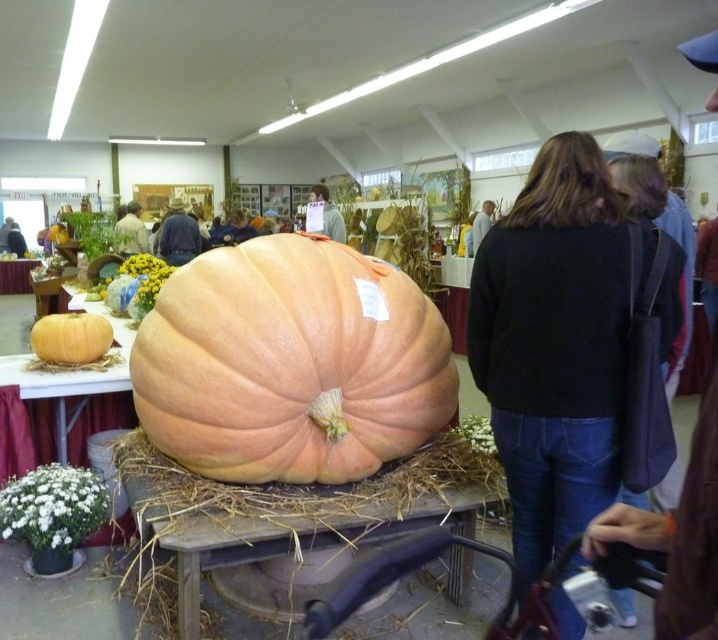
Measure the distance between dark blue fabric at center and camera.

dark blue fabric at center and camera are 6.92 meters apart from each other.

This screenshot has width=718, height=640. What do you see at coordinates (177, 236) in the screenshot? I see `dark blue fabric at center` at bounding box center [177, 236].

At what (x,y) coordinates should I click in order to perform the action: click on dark blue fabric at center. Please return your answer as a coordinate pair (x, y). Looking at the image, I should click on (177, 236).

Consider the image. Measure the distance between black fabric bag at center and matte black pumpkin at center.

The distance of black fabric bag at center from matte black pumpkin at center is 12.46 meters.

Is point (531, 445) closer to viewer compared to point (1, 228)?

Yes, it is.

Where is `black fabric bag at center`? black fabric bag at center is located at coordinates (559, 333).

Can you confirm if wooden table at center is wider than dark blue fabric at center?

Yes, wooden table at center is wider than dark blue fabric at center.

Which is in front, point (462, 467) or point (172, 259)?

Point (462, 467)

The width and height of the screenshot is (718, 640). Find the location of `wooden table at center`. wooden table at center is located at coordinates (302, 500).